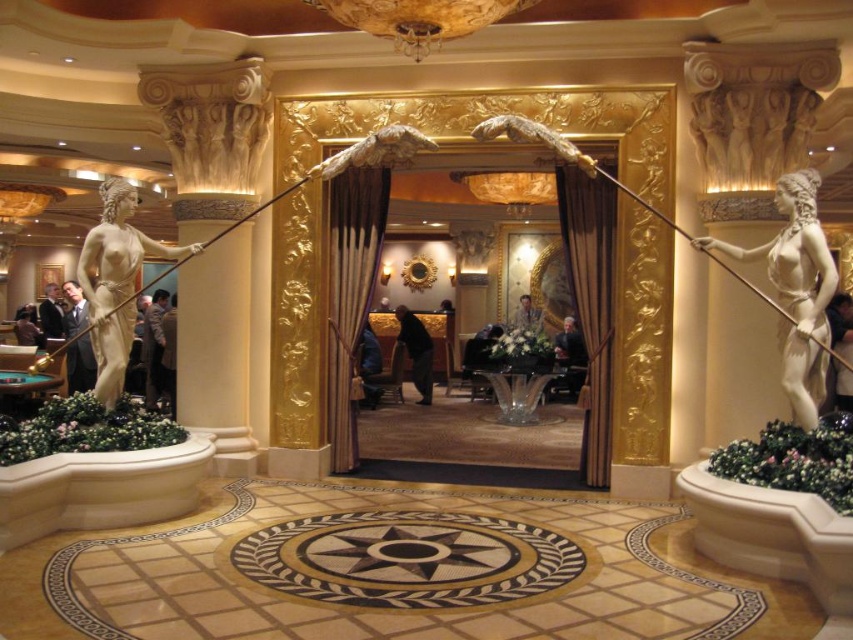
Question: Which point appears farthest from the camera in this image?

Choices:
 (A) (831, 276)
 (B) (131, 266)

Answer: (B)

Question: Which point appears farthest from the camera in this image?

Choices:
 (A) (805, 273)
 (B) (119, 372)

Answer: (B)

Question: Is white marble statue at right positioned at the back of matte gold statue at left?

Choices:
 (A) no
 (B) yes

Answer: (A)

Question: Can you confirm if white marble statue at right is smaller than matte gold statue at left?

Choices:
 (A) no
 (B) yes

Answer: (A)

Question: Among these objects, which one is farthest from the camera?

Choices:
 (A) matte gold statue at left
 (B) white marble statue at right

Answer: (A)

Question: Is white marble statue at right positioned at the back of matte gold statue at left?

Choices:
 (A) yes
 (B) no

Answer: (B)